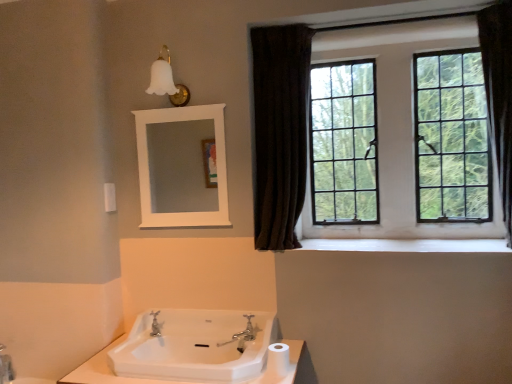
The height and width of the screenshot is (384, 512). I want to click on empty space that is to the right of silver metallic tap at lower center, so click(185, 338).